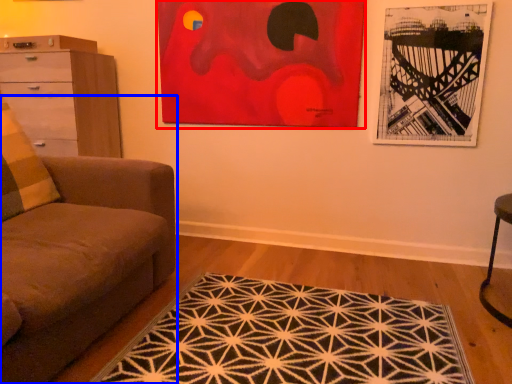
Question: Which object appears closest to the camera in this image, picture frame (highlighted by a red box) or studio couch (highlighted by a blue box)?

Choices:
 (A) picture frame
 (B) studio couch

Answer: (B)